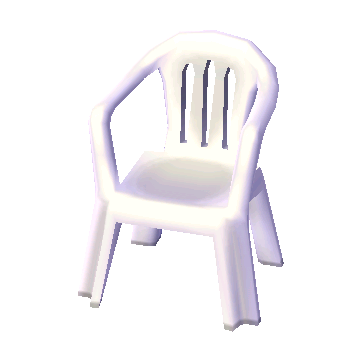
This screenshot has width=362, height=362. In order to click on armchair in this screenshot , I will do `click(103, 109)`.